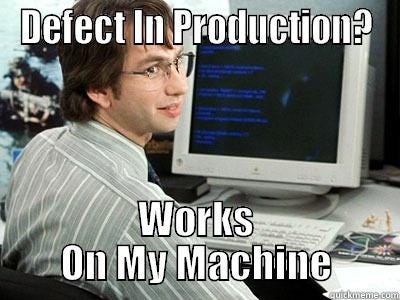
Find the location of a particular element. The width and height of the screenshot is (400, 300). keyboard is located at coordinates (280, 240).